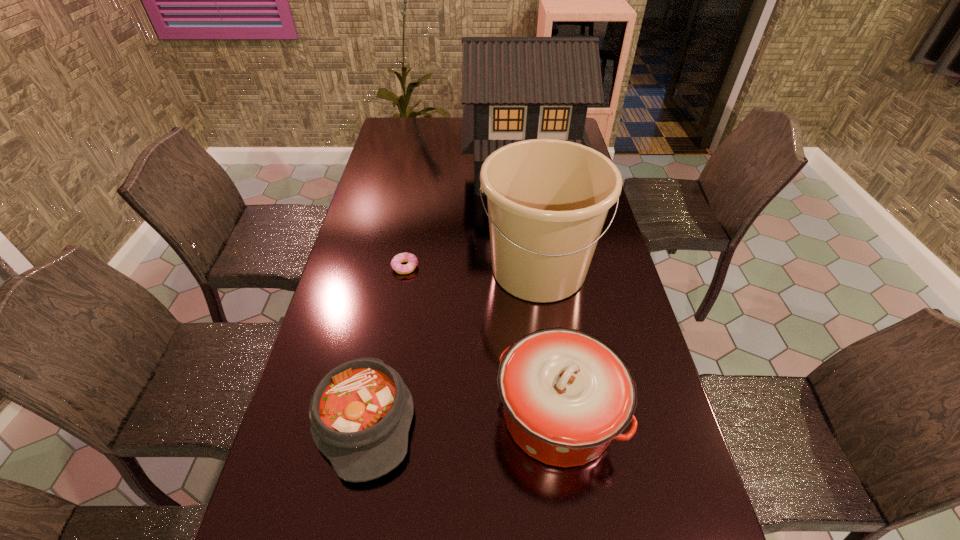
Image resolution: width=960 pixels, height=540 pixels. I want to click on vacant space located on the left of the third shortest object, so click(x=436, y=415).

Find the location of `vacant position located on the right of the shorter casserole`. vacant position located on the right of the shorter casserole is located at coordinates (531, 418).

At what (x,y) coordinates should I click in order to perform the action: click on free space located on the front of the doughnut. Please return your answer as a coordinate pair (x, y). Looking at the image, I should click on (395, 328).

Where is `object located in the far edge section of the desktop`? object located in the far edge section of the desktop is located at coordinates (514, 88).

The width and height of the screenshot is (960, 540). In order to click on casserole at the left edge in this screenshot , I will do `click(360, 413)`.

This screenshot has width=960, height=540. What are the coordinates of `doughnut located at the left edge` in the screenshot? It's located at (412, 260).

The image size is (960, 540). Identify the location of dollhouse located at the right edge. (514, 88).

Find the location of a particular element. This screenshot has height=540, width=960. bucket present at the right edge is located at coordinates (548, 199).

At what (x,y) coordinates should I click in order to perform the action: click on casserole positioned at the right edge. Please return your answer as a coordinate pair (x, y). Looking at the image, I should click on (566, 394).

The height and width of the screenshot is (540, 960). Identify the location of object situated at the far right corner. (514, 88).